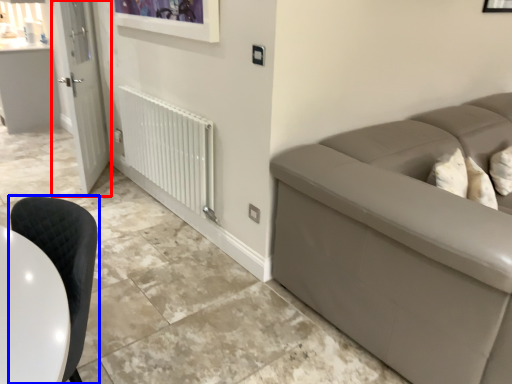
Question: Which object is closer to the camera taking this photo, door (highlighted by a red box) or chair (highlighted by a blue box)?

Choices:
 (A) door
 (B) chair

Answer: (B)